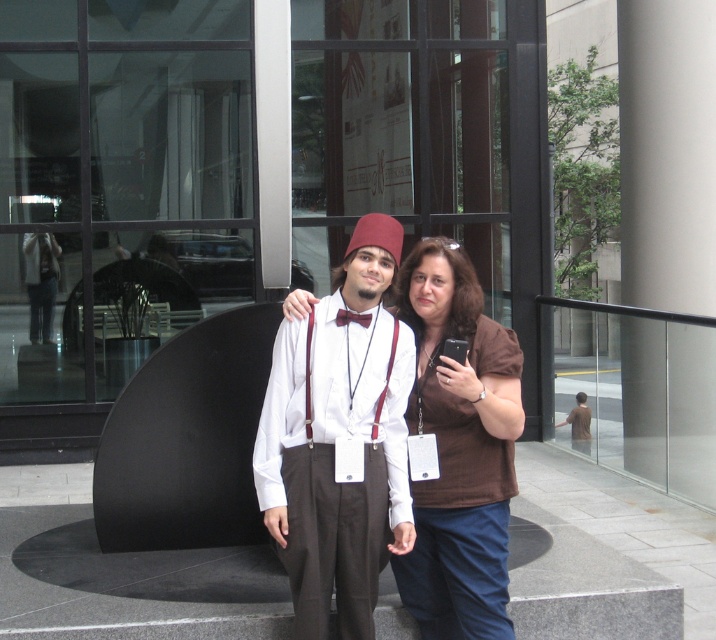
You are a photographer positioned to take a portrait of both the white matte shirt at center and the brown fabric shirt at center. Based on their positions, which one should you focus on first to ensure they are both in clear view?

The white matte shirt at center is in front of the brown fabric shirt at center, so you should focus on the white matte shirt at center first to ensure both are in clear view.